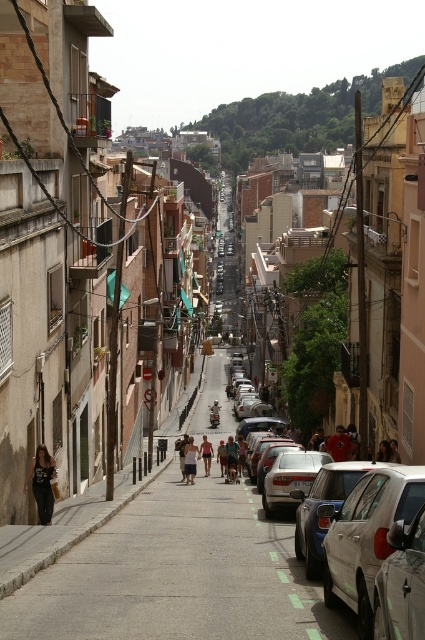
You are a pedestrian standing on the sidewalk in this narrow urban street scene. You see a satin silver sedan at center and dark blue jeans at center. Which object is nearer to you?

The satin silver sedan at center is closer to the viewer than the dark blue jeans at center.

You are a delivery person trying to locate a package in the image. The package is marked with tan fabric shorts at center. According to the coordinates provided, where exactly is the package located in the image?

The tan fabric shorts at center is located at coordinates point [190,460].

You are standing on the urban street and want to walk towards the two points marked in the scene. Which point, point (x=272, y=515) or point (x=337, y=448), will you reach first?

You will reach point (x=272, y=515) first because it is closer to the viewer than point (x=337, y=448).